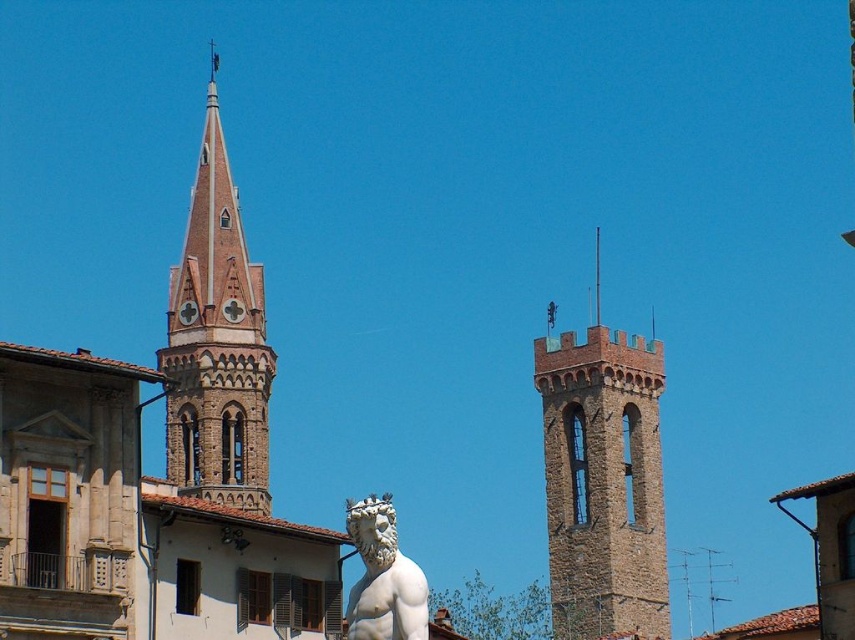
Question: Which object is farther from the camera taking this photo?

Choices:
 (A) white marble statue at center
 (B) brown stone tower at upper right

Answer: (B)

Question: Can you confirm if brown stone tower at upper right is positioned below white marble statue at center?

Choices:
 (A) no
 (B) yes

Answer: (A)

Question: Which point is closer to the camera?

Choices:
 (A) brown stone tower at upper right
 (B) white marble statue at center
 (C) brown stone spire at upper left

Answer: (B)

Question: Which point is closer to the camera taking this photo?

Choices:
 (A) (372, 596)
 (B) (219, 195)
 (C) (659, 467)

Answer: (A)

Question: Is brown stone tower at upper right in front of white marble statue at center?

Choices:
 (A) yes
 (B) no

Answer: (B)

Question: In this image, where is brown stone spire at upper left located relative to white marble statue at center?

Choices:
 (A) above
 (B) below

Answer: (A)